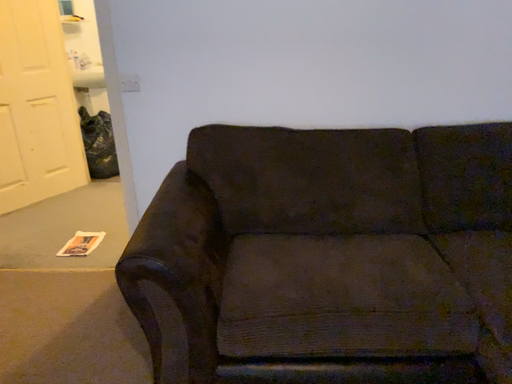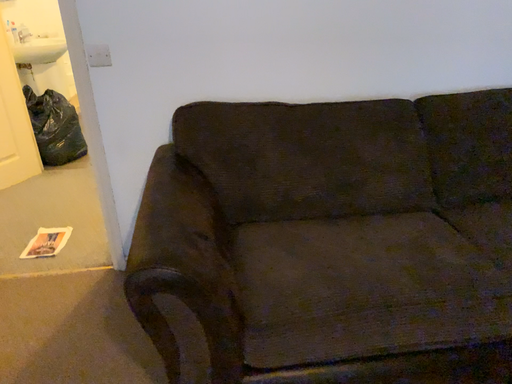
Question: Which way did the camera rotate in the video?

Choices:
 (A) rotated right
 (B) rotated left

Answer: (A)